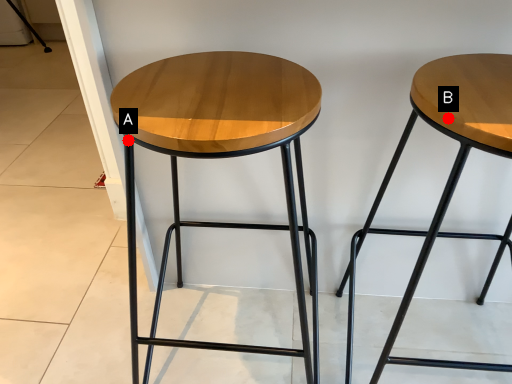
Question: Two points are circled on the image, labeled by A and B beside each circle. Which point is closer to the camera taking this photo?

Choices:
 (A) A is closer
 (B) B is closer

Answer: (B)